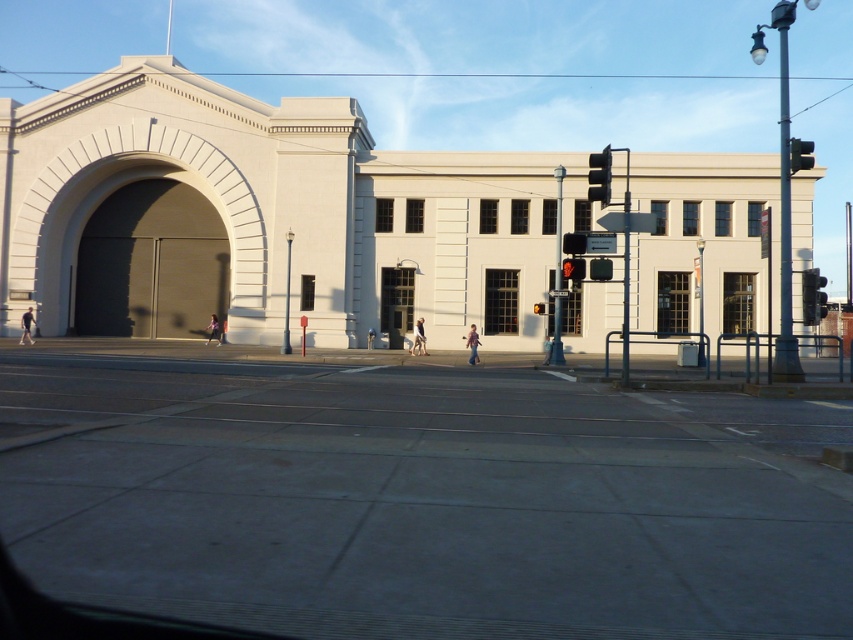
Question: Which object is the farthest from the black glass traffic light at right?

Choices:
 (A) black plastic traffic light at upper right
 (B) red glass traffic light at center
 (C) amber glass traffic light at center

Answer: (B)

Question: Observing the image, what is the correct spatial positioning of black plastic traffic light at upper right in reference to metallic traffic light at upper right?

Choices:
 (A) left
 (B) right

Answer: (A)

Question: Does black plastic traffic light at upper right have a smaller size compared to amber glass traffic light at center?

Choices:
 (A) no
 (B) yes

Answer: (A)

Question: Observing the image, what is the correct spatial positioning of black plastic traffic light at upper right in reference to metallic traffic light at upper right?

Choices:
 (A) right
 (B) left

Answer: (B)

Question: Which object is positioned closest to the red glass traffic light at center?

Choices:
 (A) amber glass traffic light at center
 (B) metallic traffic light at upper right

Answer: (A)

Question: Which is farther from the amber glass traffic light at center?

Choices:
 (A) black glass traffic light at right
 (B) metallic traffic light at upper right
 (C) red glass traffic light at center

Answer: (A)